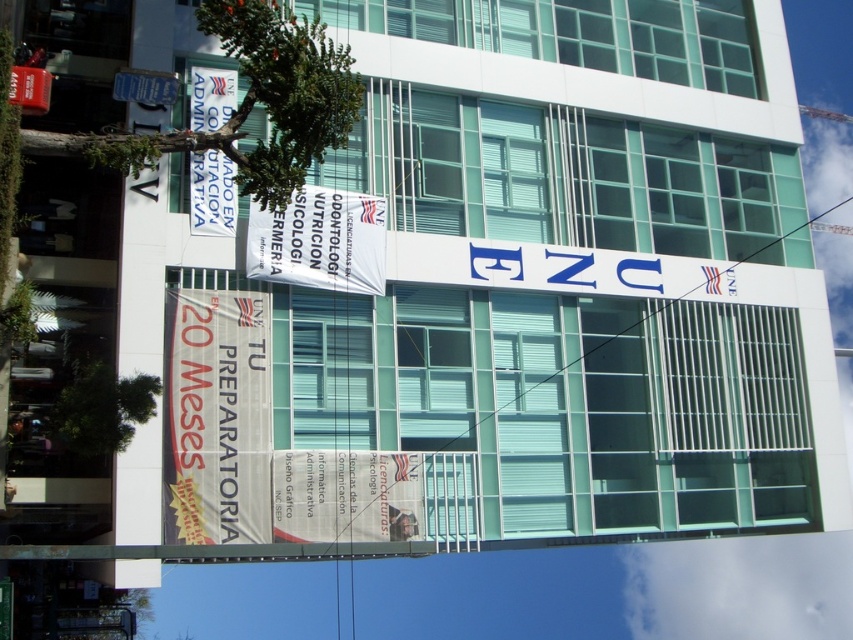
Which is more to the left, red banner at lower left or white paper banner at center?

red banner at lower left

Is red banner at lower left further to camera compared to white paper banner at center?

No, it is not.

Where is `red banner at lower left`? This screenshot has width=853, height=640. red banner at lower left is located at coordinates (218, 417).

Does red banner at lower left have a lesser width compared to white fabric banner at center?

Correct, red banner at lower left's width is less than white fabric banner at center's.

Does red banner at lower left have a larger size compared to white fabric banner at center?

No, red banner at lower left is not bigger than white fabric banner at center.

The width and height of the screenshot is (853, 640). What do you see at coordinates (218, 417) in the screenshot?
I see `red banner at lower left` at bounding box center [218, 417].

This screenshot has width=853, height=640. I want to click on red banner at lower left, so click(218, 417).

Which is below, white paper banner at center or white fabric banner at center?

white paper banner at center is below.

Does white paper banner at center have a larger size compared to white fabric banner at center?

Actually, white paper banner at center might be smaller than white fabric banner at center.

Is point (386, 504) positioned before point (286, 212)?

Yes, point (386, 504) is in front of point (286, 212).

Identify the location of white paper banner at center. (346, 497).